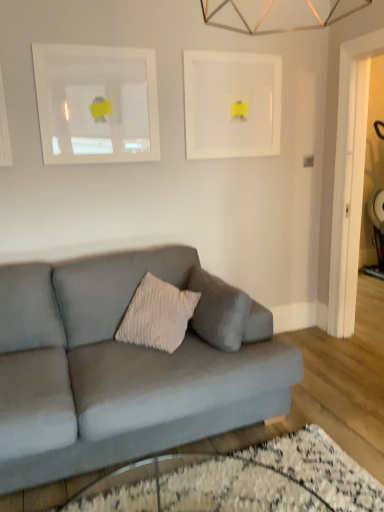
Question: Considering the relative sizes of transparent glass table at lower center and white matte picture frame at upper left, which ranks as the first picture frame in left-to-right order, in the image provided, is transparent glass table at lower center taller than white matte picture frame at upper left, which ranks as the first picture frame in left-to-right order,?

Choices:
 (A) no
 (B) yes

Answer: (A)

Question: Would you say transparent glass table at lower center contains white matte picture frame at upper left, which ranks as the first picture frame in left-to-right order?

Choices:
 (A) yes
 (B) no

Answer: (B)

Question: Does transparent glass table at lower center have a larger size compared to white matte picture frame at upper left, which ranks as the first picture frame in left-to-right order?

Choices:
 (A) yes
 (B) no

Answer: (A)

Question: From the image's perspective, is transparent glass table at lower center located beneath white matte picture frame at upper left, which is the second picture frame from right to left?

Choices:
 (A) yes
 (B) no

Answer: (A)

Question: Could you tell me if transparent glass table at lower center is facing white matte picture frame at upper left, which is the second picture frame from right to left?

Choices:
 (A) no
 (B) yes

Answer: (A)

Question: Is transparent glass table at lower center further to the viewer compared to white matte picture frame at upper left, which ranks as the first picture frame in left-to-right order?

Choices:
 (A) no
 (B) yes

Answer: (A)

Question: Does white matte picture frame at upper center, the 1th picture frame viewed from the right, come in front of matte gray couch at center?

Choices:
 (A) yes
 (B) no

Answer: (B)

Question: Considering the relative sizes of white matte picture frame at upper center, the 1th picture frame viewed from the right, and matte gray couch at center in the image provided, is white matte picture frame at upper center, the 1th picture frame viewed from the right, shorter than matte gray couch at center?

Choices:
 (A) no
 (B) yes

Answer: (B)

Question: Is white matte picture frame at upper center, which is the second picture frame from left to right, touching matte gray couch at center?

Choices:
 (A) no
 (B) yes

Answer: (A)

Question: From the image's perspective, is white matte picture frame at upper center, the 1th picture frame viewed from the right, located beneath matte gray couch at center?

Choices:
 (A) no
 (B) yes

Answer: (A)

Question: Considering the relative sizes of white matte picture frame at upper center, which is the second picture frame from left to right, and matte gray couch at center in the image provided, is white matte picture frame at upper center, which is the second picture frame from left to right, bigger than matte gray couch at center?

Choices:
 (A) yes
 (B) no

Answer: (B)

Question: Is white matte picture frame at upper center, the 1th picture frame viewed from the right, positioned beyond the bounds of matte gray couch at center?

Choices:
 (A) no
 (B) yes

Answer: (B)

Question: Considering the relative positions of transparent glass table at lower center and matte gray couch at center in the image provided, is transparent glass table at lower center behind matte gray couch at center?

Choices:
 (A) no
 (B) yes

Answer: (A)